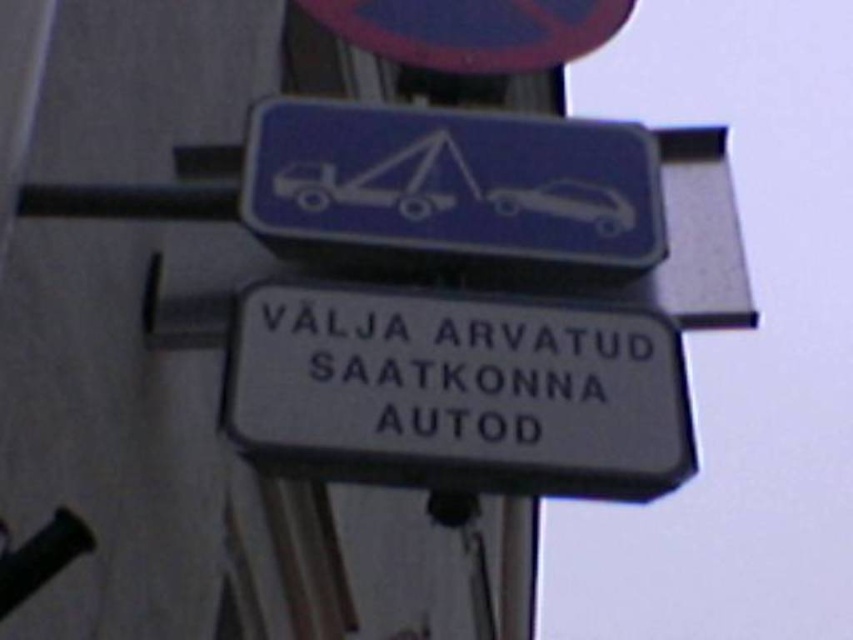
You are standing at a distance of 3 meters away from the traffic sign pole. If you want to place a small sticker on the pole at point (573, 486), can you reach it without moving closer?

The distance between you and the point (573, 486) is 3.03 meters. Since you are already 3 meters away, you would need to move slightly closer to reach it, so you cannot reach it without moving closer.

You are a delivery driver who needs to park your truck near the traffic signs. The parking spot you want to use is located at point (459, 392). Is the white plastic sign at center in the way of the parking spot?

The white plastic sign at center is located exactly at point (459, 392), so it is directly in the way of the parking spot.